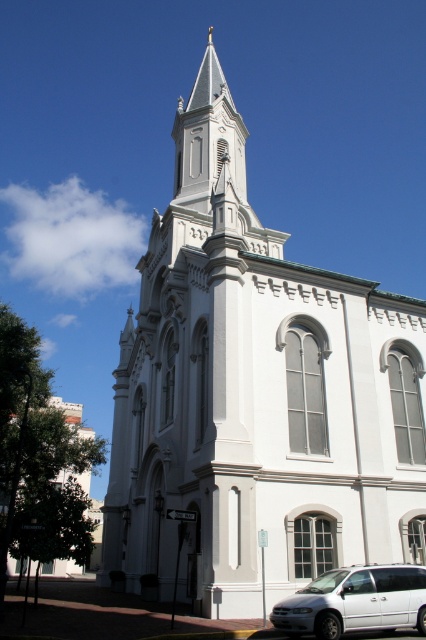
You are a photographer planning to capture the white stone church at center and the white matte van at lower right in a single frame. Based on their sizes, which object should you position closer to the camera to ensure both fit within the frame?

The white stone church at center is wider than the white matte van at lower right. To fit both in the frame, position the white matte van at lower right closer to the camera since it is narrower, allowing the wider church to be captured without exceeding the frame.

You are standing in a field and see the white stone church at center in the distance. If you want to walk directly towards it, which direction should you head?

Since the white stone church at center is located at coordinates approximately 0.619 along the x and 0.601 along the y axis, you should head towards the direction where both x and y increase slightly, but since the question is about general direction, you should walk straight towards the center of the image where the church is located.